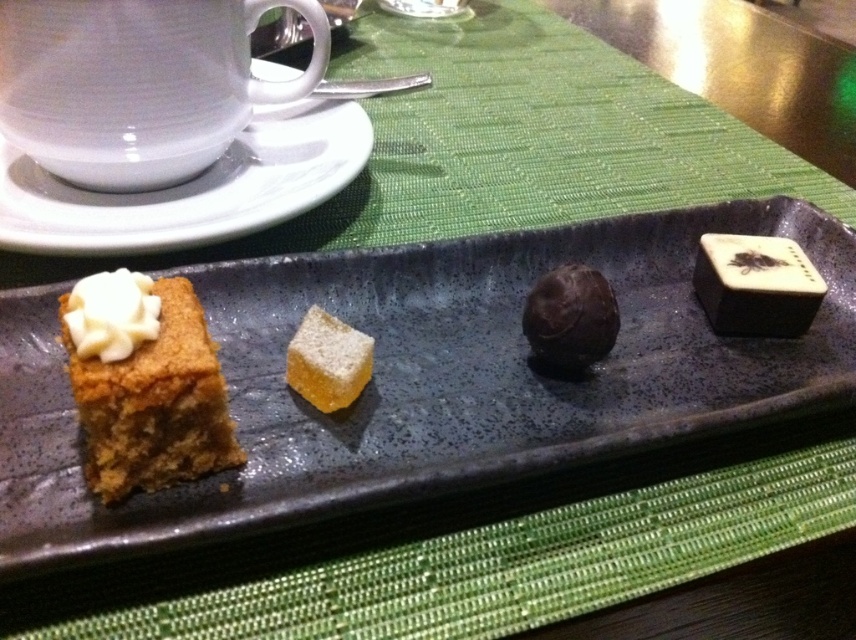
Question: Does white ceramic saucer at upper left have a lesser width compared to golden brown cake at lower left?

Choices:
 (A) no
 (B) yes

Answer: (A)

Question: Which of the following is the closest to the observer?

Choices:
 (A) white ceramic saucer at upper left
 (B) matte ceramic tray at center

Answer: (B)

Question: Among these objects, which one is nearest to the camera?

Choices:
 (A) matte ceramic tray at center
 (B) golden brown cake at lower left
 (C) yellow sugary cube at center

Answer: (A)

Question: Does matte ceramic tray at center have a greater width compared to chocolate matte truffle at center?

Choices:
 (A) no
 (B) yes

Answer: (B)

Question: Which point is farther to the camera?

Choices:
 (A) golden brown cake at lower left
 (B) yellow sugary cube at center

Answer: (B)

Question: Is white ceramic saucer at upper left bigger than golden brown cake at lower left?

Choices:
 (A) yes
 (B) no

Answer: (A)